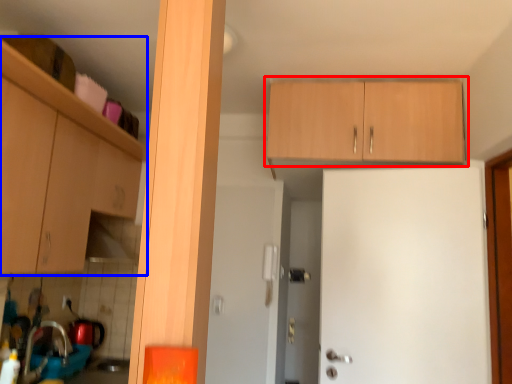
Question: Among these objects, which one is farthest to the camera, cabinetry (highlighted by a red box) or cabinetry (highlighted by a blue box)?

Choices:
 (A) cabinetry
 (B) cabinetry

Answer: (A)